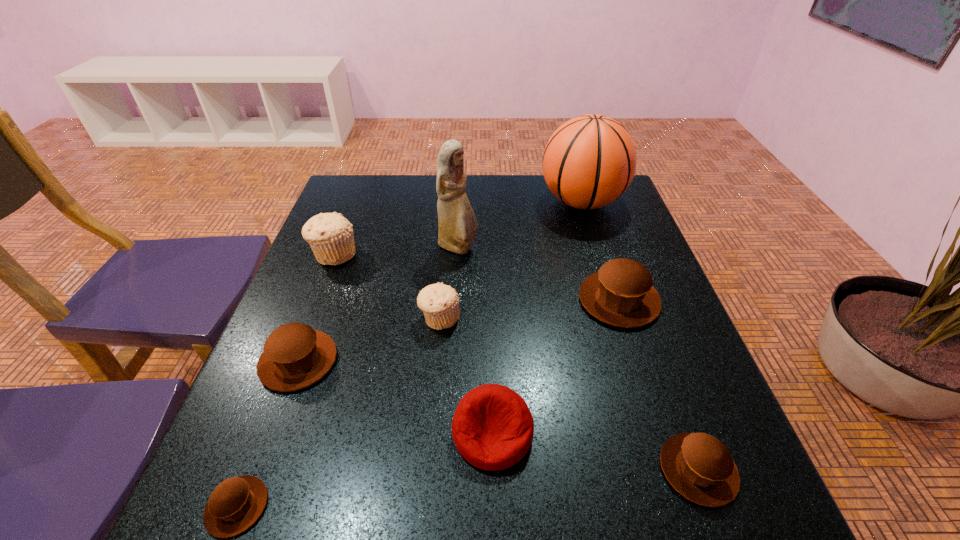
You are a GUI agent. You are given a task and a screenshot of the screen. Output one action in this format:
    pyautogui.click(x=<x>, y=<y>)
    Task: Click on the fifth tallest muffin
    The width and height of the screenshot is (960, 540).
    Given the screenshot: What is the action you would take?
    pyautogui.click(x=698, y=466)

At what (x,y) coordinates should I click in order to perform the action: click on the second smallest brown muffin. Please return your answer as a coordinate pair (x, y). The width and height of the screenshot is (960, 540). Looking at the image, I should click on (698, 466).

I want to click on the shortest muffin, so click(235, 505).

The width and height of the screenshot is (960, 540). Identify the location of the smallest brown muffin. (235, 505).

In order to click on free region located 0.260m on the front-facing side of the figurine in this screenshot , I will do `click(579, 248)`.

Find the location of a particular element. free space located 0.240m on the left of the orange basketball is located at coordinates (457, 202).

Identify the location of free space located on the front of the farther beige muffin. The image size is (960, 540). (320, 292).

What are the coordinates of `vacant space located on the left of the biggest brown muffin` in the screenshot? It's located at (521, 300).

Identify the location of free space located on the back of the right beige muffin. The height and width of the screenshot is (540, 960). (446, 244).

Where is `free location located on the back of the third nearest brown muffin`? This screenshot has height=540, width=960. free location located on the back of the third nearest brown muffin is located at coordinates pos(317,312).